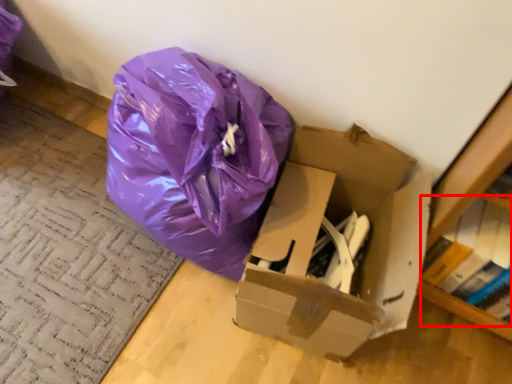
Question: Observing the image, what is the correct spatial positioning of book (annotated by the red box) in reference to box?

Choices:
 (A) left
 (B) right

Answer: (B)